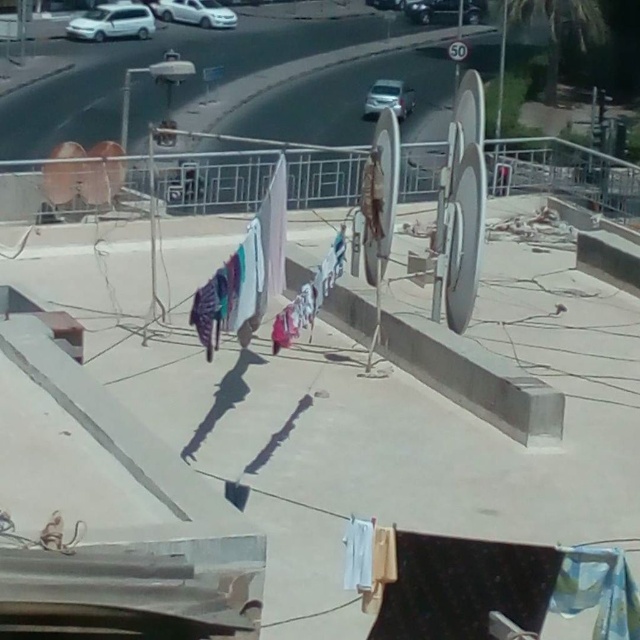
Is white glossy car at upper left thinner than white glossy car at upper center?

In fact, white glossy car at upper left might be wider than white glossy car at upper center.

Can you confirm if white glossy car at upper left is shorter than white glossy car at upper center?

Yes, white glossy car at upper left is shorter than white glossy car at upper center.

I want to click on white glossy car at upper left, so click(x=195, y=12).

Between white matte van at upper left and shiny silver sedan at upper center, which one has less height?

With less height is shiny silver sedan at upper center.

Is white matte van at upper left positioned in front of shiny silver sedan at upper center?

Yes, it is.

In order to click on white matte van at upper left in this screenshot , I will do `click(113, 22)`.

Is white glossy car at upper left above shiny silver sedan at upper center?

Actually, white glossy car at upper left is below shiny silver sedan at upper center.

Is white glossy car at upper left to the left of shiny silver sedan at upper center from the viewer's perspective?

Yes, white glossy car at upper left is to the left of shiny silver sedan at upper center.

Does point (180, 13) come closer to viewer compared to point (390, 4)?

Yes, point (180, 13) is closer to viewer.

Image resolution: width=640 pixels, height=640 pixels. Find the location of `white glossy car at upper left`. white glossy car at upper left is located at coordinates click(195, 12).